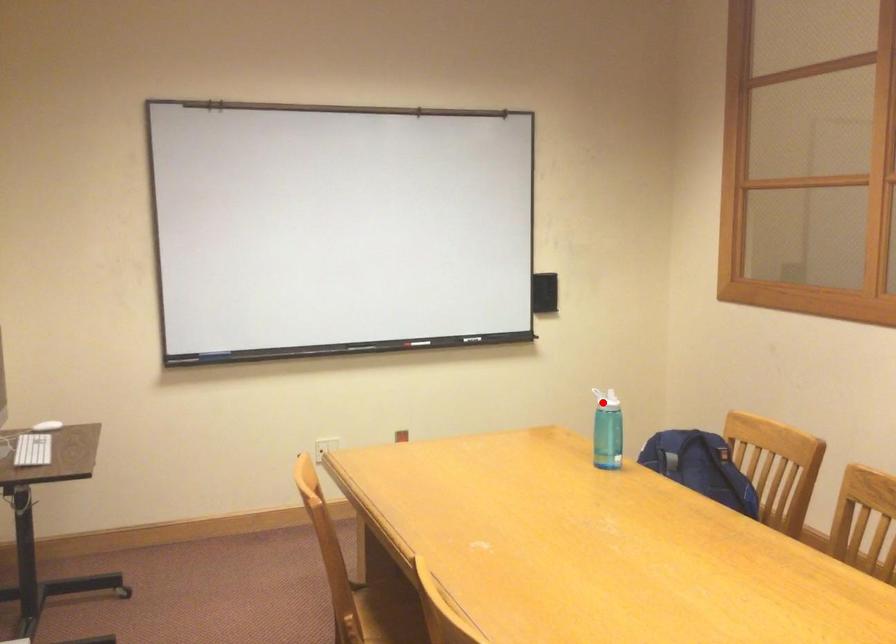
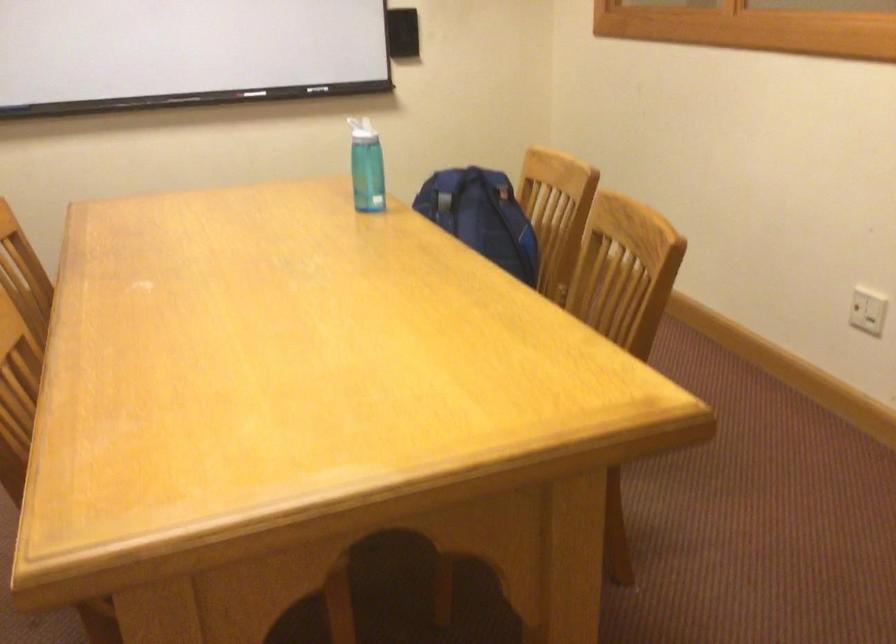
Question: I am providing you with two images of the same scene from different viewpoints. In image1, a red point is highlighted. Considering the same 3D point in image2, which of the following is correct?

Choices:
 (A) It is closer
 (B) It is farther

Answer: (A)